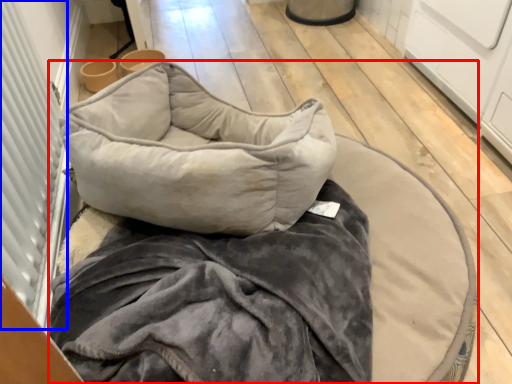
Question: Among these objects, which one is nearest to the camera, furniture (highlighted by a red box) or screen door (highlighted by a blue box)?

Choices:
 (A) furniture
 (B) screen door

Answer: (B)